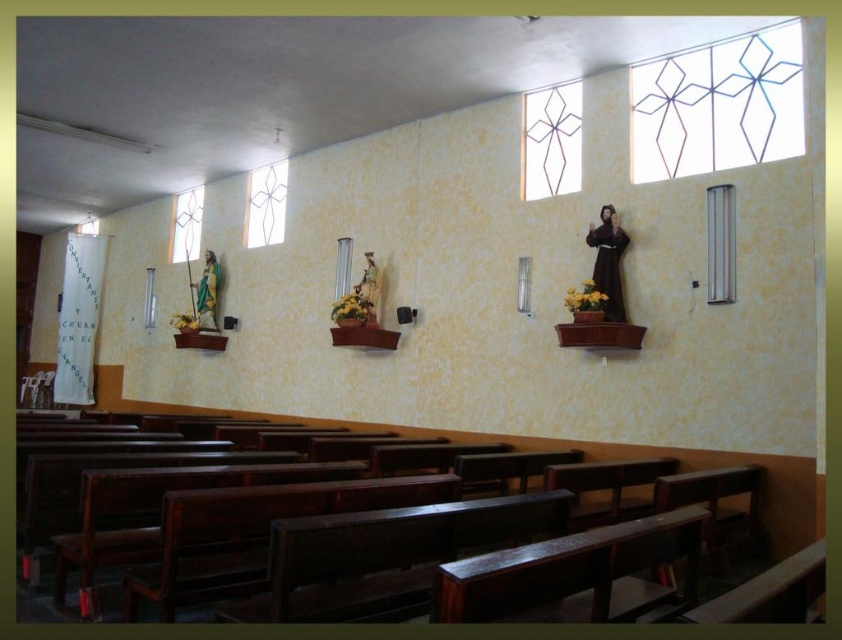
Question: Can you confirm if dark brown wood church bench at lower left is positioned to the right of clear glass window at upper left?

Choices:
 (A) yes
 (B) no

Answer: (A)

Question: Is dark brown wood church bench at lower left below clear glass cross at upper center?

Choices:
 (A) yes
 (B) no

Answer: (A)

Question: Which is farther from the clear glass window at right?

Choices:
 (A) clear glass window at upper left
 (B) clear glass cross at upper center

Answer: (A)

Question: Among these objects, which one is farthest from the camera?

Choices:
 (A) clear glass window at right
 (B) clear glass window at upper left
 (C) clear glass window at center

Answer: (B)

Question: Is clear glass cross at upper center above clear glass window at upper center?

Choices:
 (A) no
 (B) yes

Answer: (B)

Question: Estimate the real-world distances between objects in this image. Which object is closer to the clear glass window at right?

Choices:
 (A) clear glass window at upper left
 (B) dark brown wood church bench at lower left
 (C) clear glass cross at upper center
 (D) clear glass window at center

Answer: (C)